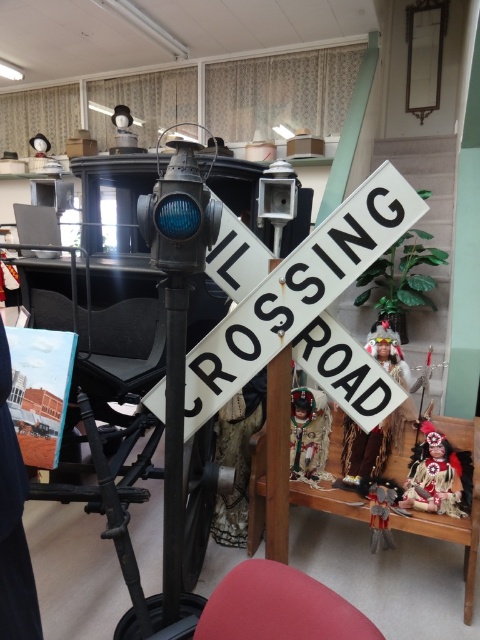
In the scene shown: Is black metal pole at center shorter than brown fabric doll at center?

No, black metal pole at center is not shorter than brown fabric doll at center.

Is point (173, 403) positioned before point (408, 387)?

Yes, point (173, 403) is closer to viewer.

This screenshot has width=480, height=640. I want to click on black metal pole at center, so click(173, 444).

Can you confirm if white matte railroad crossing sign at center is bigger than velvet doll at lower right?

Correct, white matte railroad crossing sign at center is larger in size than velvet doll at lower right.

Who is shorter, white matte railroad crossing sign at center or velvet doll at lower right?

velvet doll at lower right is shorter.

Is point (345, 278) closer to camera compared to point (384, 529)?

Yes, point (345, 278) is closer to viewer.

Where is `white matte railroad crossing sign at center`? The height and width of the screenshot is (640, 480). white matte railroad crossing sign at center is located at coordinates (300, 305).

Between matte red doll at lower right and matte brown doll at center, which one is positioned lower?

matte red doll at lower right is below.

Is point (468, 486) farther from camera compared to point (300, 444)?

No, it is not.

At what (x,y) coordinates should I click in order to perform the action: click on matte red doll at lower right. Please return your answer as a coordinate pair (x, y). The width and height of the screenshot is (480, 640). Looking at the image, I should click on (437, 476).